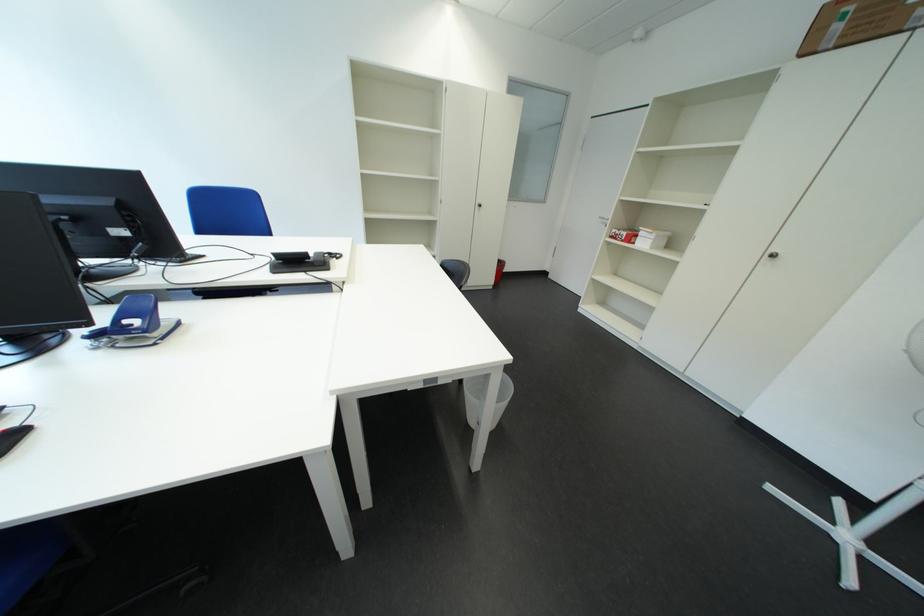
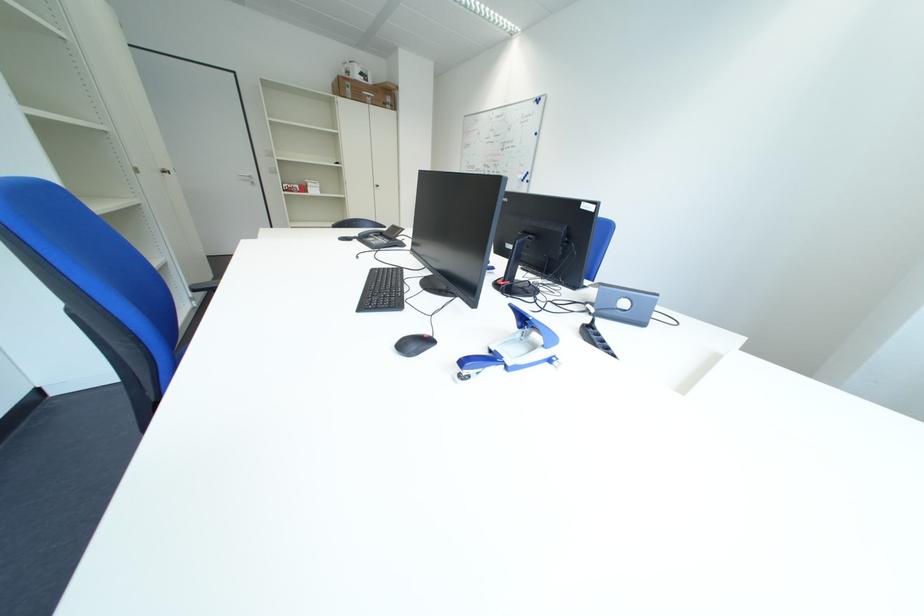
Locate, in the second image, the point that corresponds to point 849,30 in the first image.

(360, 92)